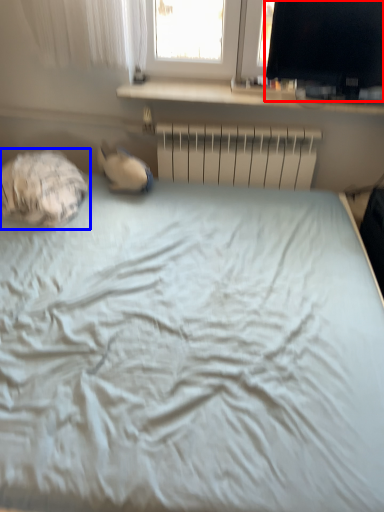
Question: Which object is further to the camera taking this photo, computer monitor (highlighted by a red box) or sleeping bag (highlighted by a blue box)?

Choices:
 (A) computer monitor
 (B) sleeping bag

Answer: (A)